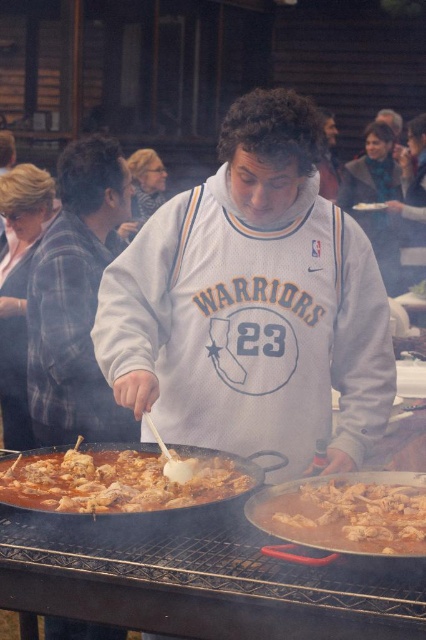
Question: Which of the following is the closest to the observer?

Choices:
 (A) (371, 205)
 (B) (115, 468)
 (C) (408, 531)
 (D) (138, 330)

Answer: (C)

Question: Where is plaid fabric shirt at left located in relation to brown matte chicken at lower left in the image?

Choices:
 (A) right
 (B) left

Answer: (B)

Question: Which of the following is the closest to the observer?

Choices:
 (A) (186, 388)
 (B) (333, 532)
 (C) (383, 202)

Answer: (B)

Question: Can you confirm if plaid fabric shirt at left is thinner than white matte plate at center?

Choices:
 (A) no
 (B) yes

Answer: (A)

Question: Which of the following is the closest to the observer?

Choices:
 (A) (138, 509)
 (B) (350, 518)
 (C) (370, 205)
 (D) (270, 353)

Answer: (B)

Question: Is brown matte chicken at lower left closer to the viewer compared to white matte plate at center?

Choices:
 (A) no
 (B) yes

Answer: (B)